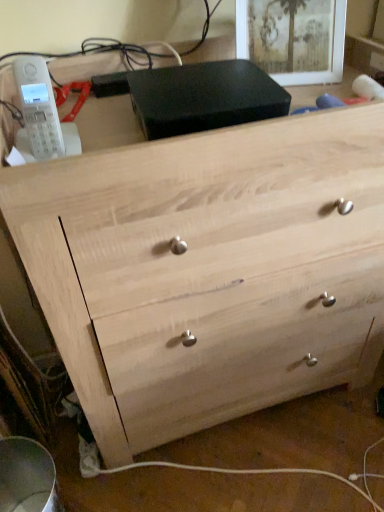
Question: From a real-world perspective, relative to natural wood chest of drawers at center, is matte black picture frame at upper center vertically above or below?

Choices:
 (A) below
 (B) above

Answer: (B)

Question: Considering the positions of matte black picture frame at upper center and natural wood chest of drawers at center in the image, is matte black picture frame at upper center wider or thinner than natural wood chest of drawers at center?

Choices:
 (A) thin
 (B) wide

Answer: (A)

Question: Is matte black picture frame at upper center in front of or behind natural wood chest of drawers at center in the image?

Choices:
 (A) front
 (B) behind

Answer: (B)

Question: Considering the positions of natural wood chest of drawers at center and matte black picture frame at upper center in the image, is natural wood chest of drawers at center bigger or smaller than matte black picture frame at upper center?

Choices:
 (A) big
 (B) small

Answer: (A)

Question: Choose the correct answer: Is natural wood chest of drawers at center inside matte black picture frame at upper center or outside it?

Choices:
 (A) outside
 (B) inside

Answer: (A)

Question: Based on their positions, is natural wood chest of drawers at center located to the left or right of matte black picture frame at upper center?

Choices:
 (A) left
 (B) right

Answer: (A)

Question: Considering the positions of point (104, 161) and point (304, 70), is point (104, 161) closer or farther from the camera than point (304, 70)?

Choices:
 (A) closer
 (B) farther

Answer: (A)